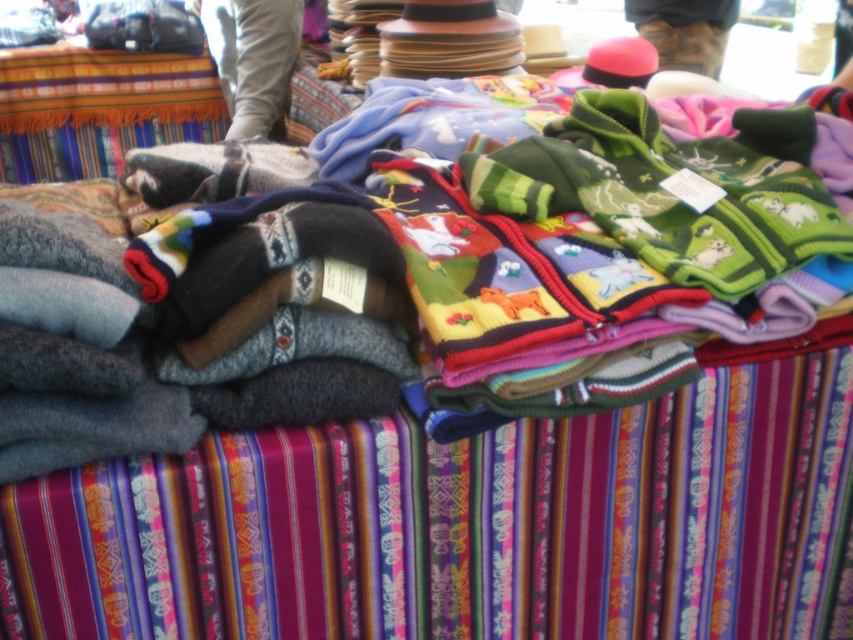
Question: Among these objects, which one is farthest from the camera?

Choices:
 (A) knitted wool sweater at upper center
 (B) camouflage-patterned pants at upper center

Answer: (A)

Question: Considering the relative positions of knitted wool sweater at upper center and camouflage-patterned pants at upper center in the image provided, where is knitted wool sweater at upper center located with respect to camouflage-patterned pants at upper center?

Choices:
 (A) left
 (B) right

Answer: (A)

Question: Can you confirm if knitted wool sweater at upper center is bigger than camouflage-patterned pants at upper center?

Choices:
 (A) yes
 (B) no

Answer: (A)

Question: Which point is farther to the camera?

Choices:
 (A) (262, 132)
 (B) (643, 26)

Answer: (B)

Question: Does knitted wool sweater at upper center have a smaller size compared to camouflage-patterned pants at upper center?

Choices:
 (A) yes
 (B) no

Answer: (B)

Question: Which object appears closest to the camera in this image?

Choices:
 (A) camouflage-patterned pants at upper center
 (B) knitted wool sweater at upper center

Answer: (A)